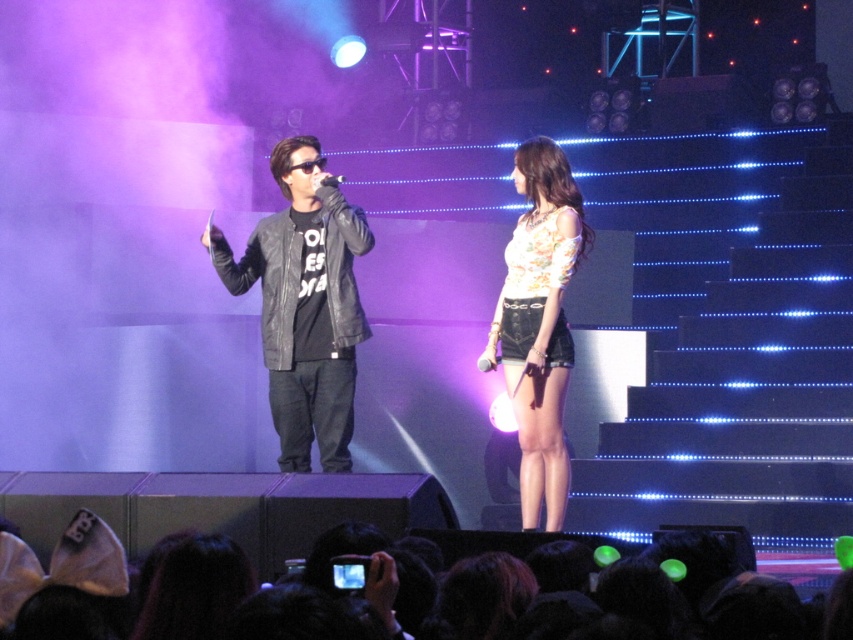
Can you confirm if floral fabric top at center is smaller than black matte microphone at center?

Actually, floral fabric top at center might be larger than black matte microphone at center.

Is point (548, 253) positioned before point (328, 177)?

That is False.

Which is behind, point (531, 164) or point (320, 182)?

The point (531, 164) is more distant.

You are a GUI agent. You are given a task and a screenshot of the screen. Output one action in this format:
    pyautogui.click(x=<x>, y=<y>)
    Task: Click on the floral fabric top at center
    
    Given the screenshot: What is the action you would take?
    pyautogui.click(x=538, y=323)

Is black leather jacket at center wider than black matte microphone at center?

Yes.

Is point (305, 432) closer to viewer compared to point (321, 180)?

No, it is behind (321, 180).

Does point (297, 349) lie in front of point (340, 173)?

Yes, it is in front of point (340, 173).

Where is `black leather jacket at center`? black leather jacket at center is located at coordinates (305, 305).

Does black leather jacket at center have a greater height compared to floral fabric top at center?

Incorrect, black leather jacket at center's height is not larger of floral fabric top at center's.

Is point (273, 161) farther from camera compared to point (544, 500)?

No, (273, 161) is closer to viewer.

What are the coordinates of `black leather jacket at center` in the screenshot? It's located at (305, 305).